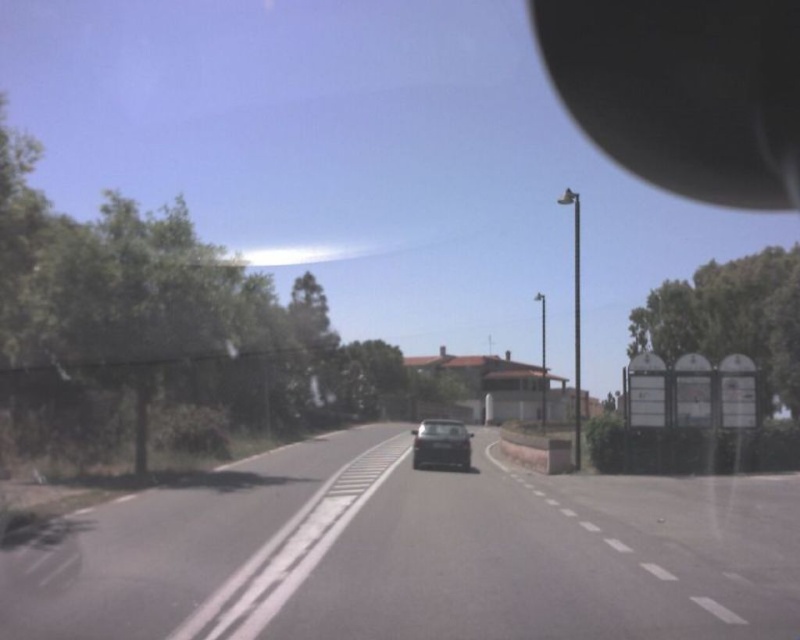
Between black rubber view mirror at upper right and satin black car at center, which one has more height?

black rubber view mirror at upper right

Between black rubber view mirror at upper right and satin black car at center, which one appears on the right side from the viewer's perspective?

black rubber view mirror at upper right

Does point (740, 168) come closer to viewer compared to point (420, 451)?

No, (740, 168) is behind (420, 451).

You are a GUI agent. You are given a task and a screenshot of the screen. Output one action in this format:
    pyautogui.click(x=<x>, y=<y>)
    Task: Click on the black rubber view mirror at upper right
    The height and width of the screenshot is (640, 800).
    Given the screenshot: What is the action you would take?
    pyautogui.click(x=684, y=90)

Which is more to the right, black asphalt road at center or black rubber view mirror at upper right?

Positioned to the right is black rubber view mirror at upper right.

Does black asphalt road at center have a larger size compared to black rubber view mirror at upper right?

No, black asphalt road at center is not bigger than black rubber view mirror at upper right.

Identify the location of black asphalt road at center. This screenshot has height=640, width=800. (414, 554).

Does black asphalt road at center appear under satin black car at center?

No, black asphalt road at center is not below satin black car at center.

Does black asphalt road at center lie in front of satin black car at center?

Yes, it is.

You are a GUI agent. You are given a task and a screenshot of the screen. Output one action in this format:
    pyautogui.click(x=<x>, y=<y>)
    Task: Click on the black asphalt road at center
    This screenshot has width=800, height=640.
    Given the screenshot: What is the action you would take?
    pyautogui.click(x=414, y=554)

Image resolution: width=800 pixels, height=640 pixels. Identify the location of black asphalt road at center. click(x=414, y=554).